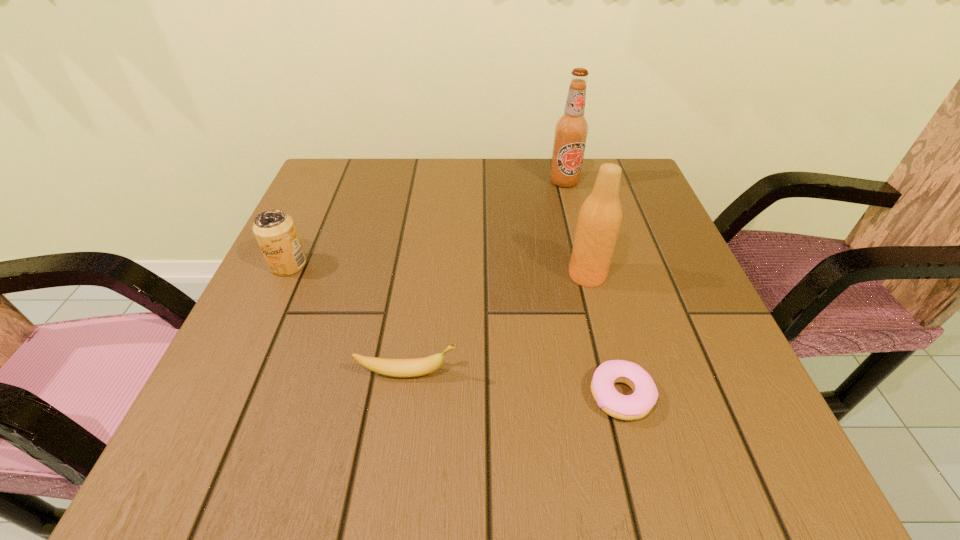
Where is `free space between the shortest object and the farther beer bottle`? free space between the shortest object and the farther beer bottle is located at coordinates (592, 288).

Image resolution: width=960 pixels, height=540 pixels. I want to click on vacant area that lies between the beer can and the nearer beer bottle, so click(438, 270).

At what (x,y) coordinates should I click in order to perform the action: click on free point between the second shortest object and the farthest object. Please return your answer as a coordinate pair (x, y). Looking at the image, I should click on (486, 278).

Locate an element on the screen. The height and width of the screenshot is (540, 960). object that stands as the second closest to the farthest object is located at coordinates (645, 394).

Locate an element on the screen. Image resolution: width=960 pixels, height=540 pixels. object that ranks as the third closest to the beer can is located at coordinates (645, 394).

Locate an element on the screen. The width and height of the screenshot is (960, 540). free region that satisfies the following two spatial constraints: 1. on the front label of the farther beer bottle; 2. on the left side of the shortest object is located at coordinates (618, 395).

Image resolution: width=960 pixels, height=540 pixels. Find the location of `vacant space that satisfies the following two spatial constraints: 1. on the back side of the shortest object; 2. at the stem of the fourth object from right to left`. vacant space that satisfies the following two spatial constraints: 1. on the back side of the shortest object; 2. at the stem of the fourth object from right to left is located at coordinates (615, 373).

Locate an element on the screen. The image size is (960, 540). vacant space that satisfies the following two spatial constraints: 1. on the front label of the farther beer bottle; 2. at the stem of the banana is located at coordinates (612, 373).

Locate an element on the screen. The width and height of the screenshot is (960, 540). vacant space that satisfies the following two spatial constraints: 1. on the front label of the farthest object; 2. on the right side of the doughnut is located at coordinates (618, 395).

Identify the location of free location that satisfies the following two spatial constraints: 1. at the stem of the doughnut; 2. on the right side of the banana. (404, 395).